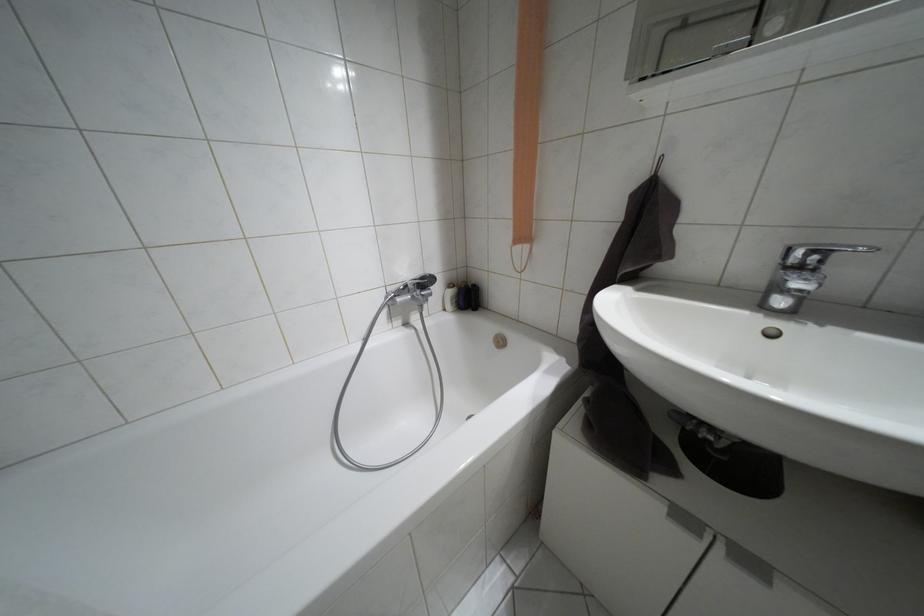
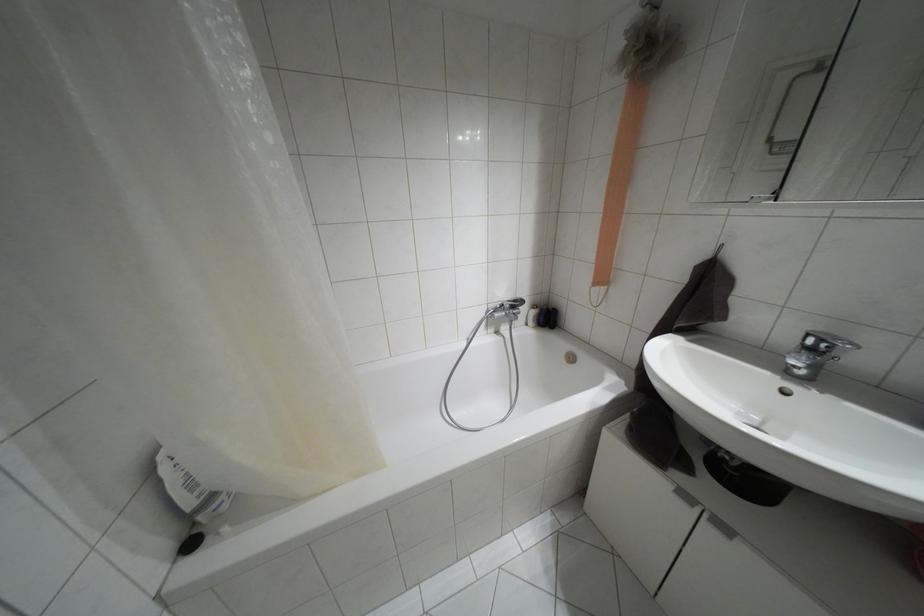
Find the pixel in the second image that matches [468,297] in the first image.

(546, 317)